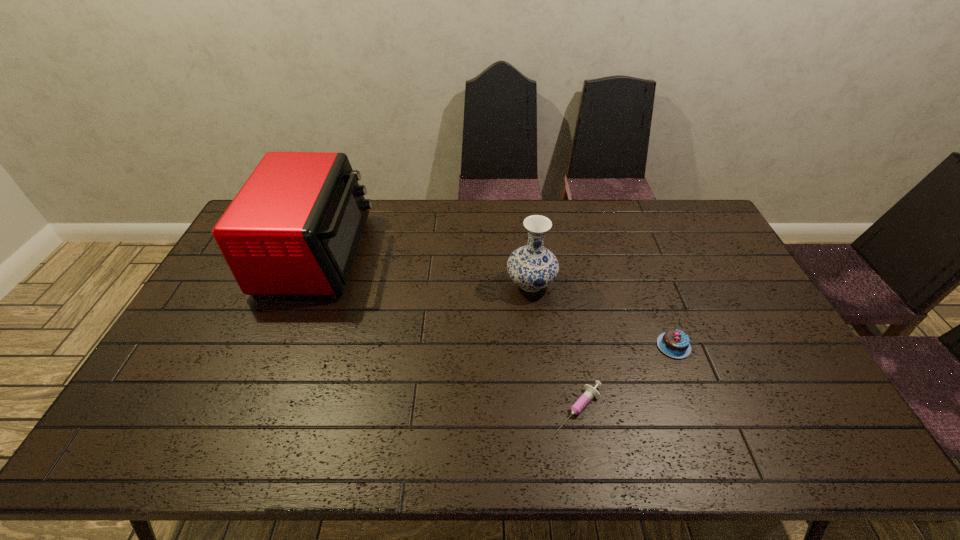
Point out which object is positioned as the second nearest to the vase. Please provide its 2D coordinates. Your answer should be formatted as a tuple, i.e. [(x, y)], where the tuple contains the x and y coordinates of a point satisfying the conditions above.

[(591, 392)]

Select which object is the second closest to the vase. Please provide its 2D coordinates. Your answer should be formatted as a tuple, i.e. [(x, y)], where the tuple contains the x and y coordinates of a point satisfying the conditions above.

[(591, 392)]

Locate an element on the screen. This screenshot has width=960, height=540. vacant space that satisfies the following two spatial constraints: 1. on the front-facing side of the leftmost object; 2. on the back side of the second nearest object is located at coordinates (281, 346).

Find the location of a particular element. vacant region that satisfies the following two spatial constraints: 1. on the back side of the shortest object; 2. on the left side of the second shortest object is located at coordinates pos(568,346).

Where is `blank space that satisfies the following two spatial constraints: 1. on the front-facing side of the leftmost object; 2. on the right side of the vase`? blank space that satisfies the following two spatial constraints: 1. on the front-facing side of the leftmost object; 2. on the right side of the vase is located at coordinates (306, 284).

The height and width of the screenshot is (540, 960). I want to click on vacant region that satisfies the following two spatial constraints: 1. on the back side of the shortest object; 2. on the left side of the second nearest object, so click(x=568, y=346).

The width and height of the screenshot is (960, 540). What are the coordinates of `vacant space that satisfies the following two spatial constraints: 1. on the back side of the syringe; 2. on the right side of the second nearest object` in the screenshot? It's located at (568, 346).

Where is `free space that satisfies the following two spatial constraints: 1. on the front-facing side of the toaster oven; 2. on the left side of the vase`? free space that satisfies the following two spatial constraints: 1. on the front-facing side of the toaster oven; 2. on the left side of the vase is located at coordinates pos(306,284).

The image size is (960, 540). Find the location of `vacant space that satisfies the following two spatial constraints: 1. on the front-facing side of the toaster oven; 2. on the right side of the vase`. vacant space that satisfies the following two spatial constraints: 1. on the front-facing side of the toaster oven; 2. on the right side of the vase is located at coordinates (306, 284).

Locate an element on the screen. Image resolution: width=960 pixels, height=540 pixels. vacant space that satisfies the following two spatial constraints: 1. on the front-facing side of the leftmost object; 2. on the right side of the second shortest object is located at coordinates (281, 346).